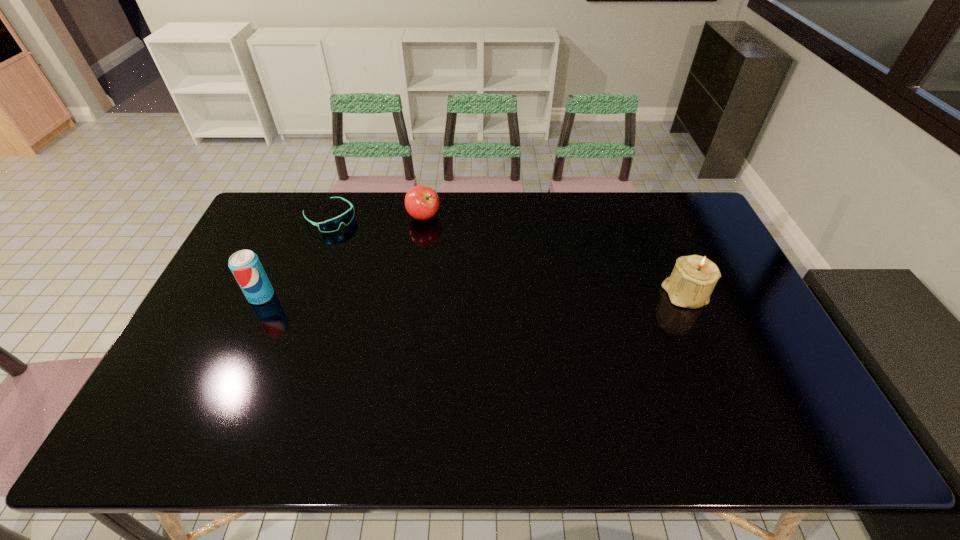
Where is `free space that is in between the rightmost object and the sunglasses`? free space that is in between the rightmost object and the sunglasses is located at coordinates (507, 256).

You are a GUI agent. You are given a task and a screenshot of the screen. Output one action in this format:
    pyautogui.click(x=<x>, y=<y>)
    Task: Click on the free space that is in between the shortest object and the soda can
    This screenshot has height=540, width=960.
    Given the screenshot: What is the action you would take?
    pyautogui.click(x=296, y=256)

This screenshot has width=960, height=540. Identify the location of free point between the rightmost object and the sunglasses. (507, 256).

I want to click on free spot between the apple and the soda can, so click(343, 256).

Point out which object is positioned as the second nearest to the rightmost object. Please provide its 2D coordinates. Your answer should be formatted as a tuple, i.e. [(x, y)], where the tuple contains the x and y coordinates of a point satisfying the conditions above.

[(331, 225)]

Identify which object is the second nearest to the soda can. Please provide its 2D coordinates. Your answer should be formatted as a tuple, i.e. [(x, y)], where the tuple contains the x and y coordinates of a point satisfying the conditions above.

[(421, 202)]